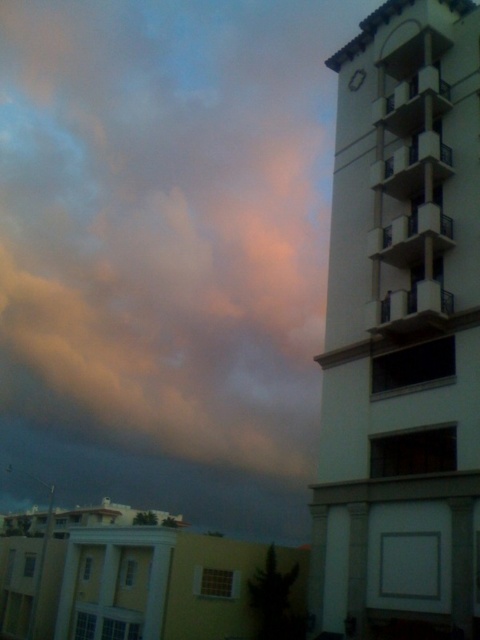
You are standing in the middle of the scene and want to take a photo of the white concrete bell tower at right. Which direction should you turn to face it?

Since the white concrete bell tower at right is located at point 0.523 on the x axis and 0.840 on the y axis, you should turn to your right to face it.

You are standing in front of the modern building and looking at the sky scene. There are two points marked in the image. One is at coordinate point (x=478, y=42) and the other is at point (x=355, y=70). Which of these two points is closer to your eyes?

Point (x=478, y=42) is closer to the camera than point (x=355, y=70).

You are an architect analyzing the building in the image. You notice the white concrete bell tower at right and the metallic silver clock at upper right. Which of these two objects has a greater height?

The white concrete bell tower at right is much taller than the metallic silver clock at upper right, so it has a greater height.